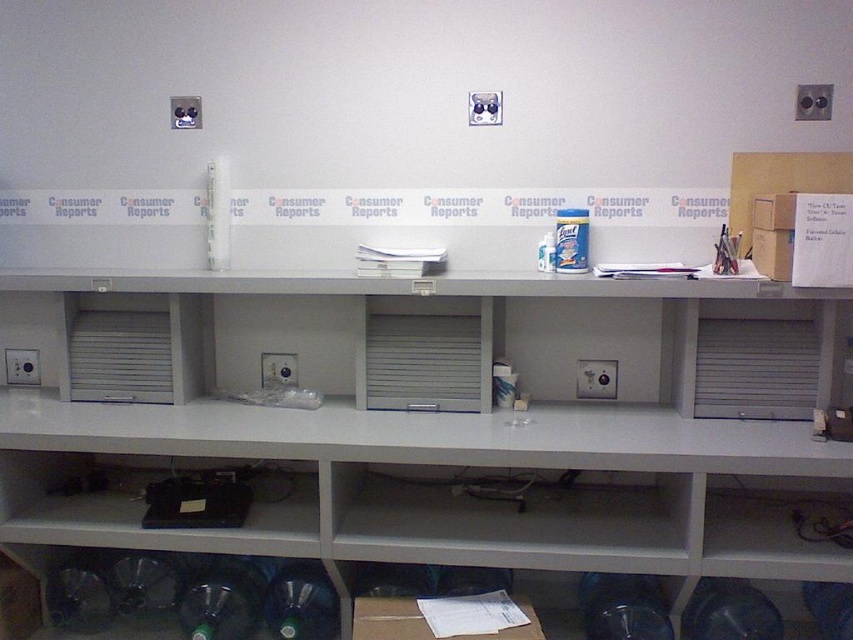
Looking at this image, who is taller, white matte table at center or green matte bottle at lower left?

white matte table at center

Where is `white matte table at center`? white matte table at center is located at coordinates (440, 433).

You are a GUI agent. You are given a task and a screenshot of the screen. Output one action in this format:
    pyautogui.click(x=<x>, y=<y>)
    Task: Click on the white matte table at center
    
    Given the screenshot: What is the action you would take?
    pyautogui.click(x=440, y=433)

From the picture: Can you confirm if white matte shelf at lower center is positioned to the right of green matte bottle at lower left?

Indeed, white matte shelf at lower center is positioned on the right side of green matte bottle at lower left.

Is point (682, 532) farther from camera compared to point (256, 577)?

No, it is in front of (256, 577).

In order to click on white matte shelf at lower center in this screenshot , I will do `click(518, 524)`.

Which is below, white matte shelf at lower center or black plastic shelf at lower left?

black plastic shelf at lower left

Which is more to the right, white matte shelf at lower center or black plastic shelf at lower left?

Positioned to the right is white matte shelf at lower center.

Measure the distance between white matte shelf at lower center and camera.

The distance of white matte shelf at lower center from camera is 6.60 feet.

Locate an element on the screen. white matte shelf at lower center is located at coordinates (518, 524).